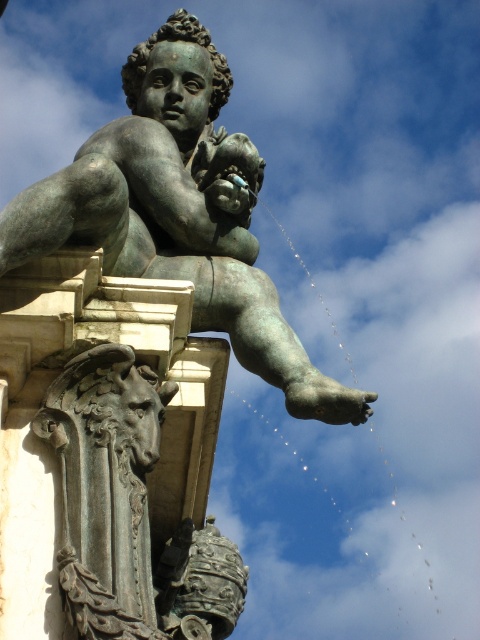
Who is positioned more to the left, green patina bronze statue at center or dark gray stone horse head at lower left?

green patina bronze statue at center is more to the left.

Describe the element at coordinates (179, 212) in the screenshot. The height and width of the screenshot is (640, 480). I see `green patina bronze statue at center` at that location.

Identify the location of green patina bronze statue at center. This screenshot has height=640, width=480. (179, 212).